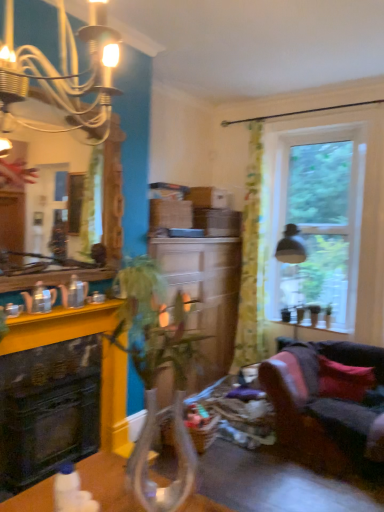
Question: Can you confirm if clear glass window at upper right is shorter than green leafy plant at center?

Choices:
 (A) yes
 (B) no

Answer: (B)

Question: From a real-world perspective, is clear glass window at upper right below green leafy plant at center?

Choices:
 (A) yes
 (B) no

Answer: (B)

Question: From a real-world perspective, is clear glass window at upper right on top of green leafy plant at center?

Choices:
 (A) yes
 (B) no

Answer: (A)

Question: Would you say clear glass window at upper right is outside green leafy plant at center?

Choices:
 (A) no
 (B) yes

Answer: (B)

Question: From the image's perspective, is clear glass window at upper right on green leafy plant at center?

Choices:
 (A) yes
 (B) no

Answer: (A)

Question: Would you say velvet dark grey couch at lower right is to the left or to the right of green leafy plant at center in the picture?

Choices:
 (A) right
 (B) left

Answer: (A)

Question: Based on their sizes in the image, would you say velvet dark grey couch at lower right is bigger or smaller than green leafy plant at center?

Choices:
 (A) big
 (B) small

Answer: (A)

Question: Looking at their shapes, would you say velvet dark grey couch at lower right is wider or thinner than green leafy plant at center?

Choices:
 (A) wide
 (B) thin

Answer: (A)

Question: Is velvet dark grey couch at lower right inside or outside of green leafy plant at center?

Choices:
 (A) outside
 (B) inside

Answer: (A)

Question: From a real-world perspective, is yellow wood counter at left above or below velvet dark grey couch at lower right?

Choices:
 (A) above
 (B) below

Answer: (A)

Question: From the image's perspective, is yellow wood counter at left positioned above or below velvet dark grey couch at lower right?

Choices:
 (A) above
 (B) below

Answer: (A)

Question: In terms of height, does yellow wood counter at left look taller or shorter compared to velvet dark grey couch at lower right?

Choices:
 (A) tall
 (B) short

Answer: (B)

Question: Is yellow wood counter at left in front of or behind velvet dark grey couch at lower right in the image?

Choices:
 (A) behind
 (B) front

Answer: (B)

Question: Which is correct: translucent floral fabric curtain at right is inside wooden mirror at upper left, or outside of it?

Choices:
 (A) inside
 (B) outside

Answer: (B)

Question: From a real-world perspective, is translucent floral fabric curtain at right physically located above or below wooden mirror at upper left?

Choices:
 (A) above
 (B) below

Answer: (B)